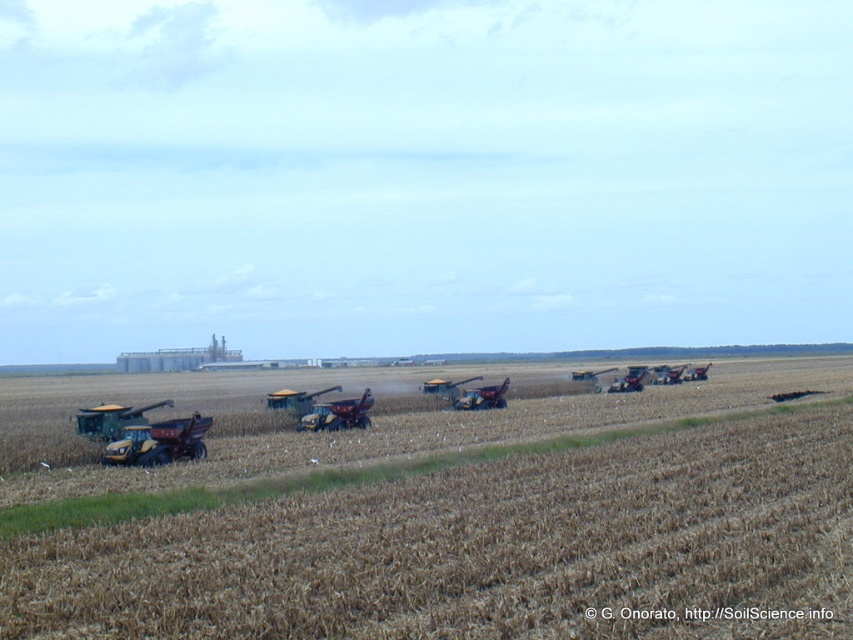
Which is more to the left, brown matte wheat field at center or yellow metallic tractor at lower left?

Positioned to the left is yellow metallic tractor at lower left.

From the picture: Which of these two, brown matte wheat field at center or yellow metallic tractor at lower left, stands taller?

brown matte wheat field at center is taller.

Is point (329, 570) less distant than point (108, 465)?

Yes, it is.

Locate an element on the screen. The width and height of the screenshot is (853, 640). brown matte wheat field at center is located at coordinates (461, 524).

Does yellow-green plastic tractor at lower left appear on the left side of metallic red tractor at center-right?

Correct, you'll find yellow-green plastic tractor at lower left to the left of metallic red tractor at center-right.

The image size is (853, 640). What do you see at coordinates (111, 419) in the screenshot?
I see `yellow-green plastic tractor at lower left` at bounding box center [111, 419].

At what (x,y) coordinates should I click in order to perform the action: click on yellow-green plastic tractor at lower left. Please return your answer as a coordinate pair (x, y). This screenshot has width=853, height=640. Looking at the image, I should click on (111, 419).

Is metallic yellow tractor at center to the right of metallic red tractor at center-right from the viewer's perspective?

In fact, metallic yellow tractor at center is to the left of metallic red tractor at center-right.

Which of these two, metallic yellow tractor at center or metallic red tractor at center-right, stands shorter?

metallic yellow tractor at center

Is point (341, 408) positioned behind point (624, 381)?

No, (341, 408) is in front of (624, 381).

Find the location of a particular element. This screenshot has width=853, height=640. metallic yellow tractor at center is located at coordinates (338, 413).